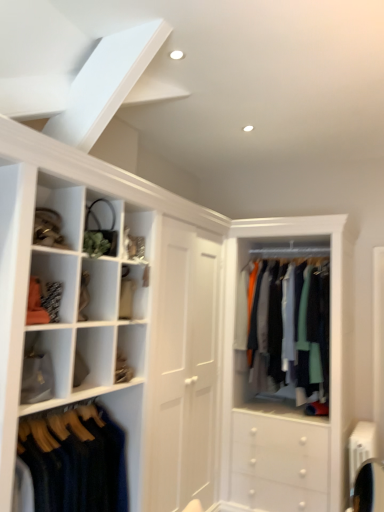
Question: From a real-world perspective, is matte gold purse at upper left, marked as the 2th cabinet in a bottom-to-top arrangement, physically located above or below matte black purse at upper left, which is the third cabinet in bottom-to-top order?

Choices:
 (A) below
 (B) above

Answer: (A)

Question: Looking at the image, does matte gold purse at upper left, marked as the 2th cabinet in a bottom-to-top arrangement, seem bigger or smaller compared to matte black purse at upper left, which is the third cabinet in bottom-to-top order?

Choices:
 (A) small
 (B) big

Answer: (B)

Question: Estimate the real-world distances between objects in this image. Which object is closer to the silky cotton shirts at center, the second clothing when ordered from left to right?

Choices:
 (A) dark blue wool sweater at lower left, placed as the first clothing when sorted from left to right
 (B) matte gold purse at upper left, marked as the 2th cabinet in a bottom-to-top arrangement
 (C) matte white shelf at lower left, placed as the first cabinet when sorted from bottom to top
 (D) matte black purse at upper left, which is the third cabinet in bottom-to-top order

Answer: (A)

Question: Estimate the real-world distances between objects in this image. Which object is farther from the matte gold purse at upper left, the second cabinet positioned from the top?

Choices:
 (A) silky cotton shirts at center, the 1th clothing from the back
 (B) matte black purse at upper left, which is the third cabinet in bottom-to-top order
 (C) matte white shelf at lower left, positioned as the third cabinet in top-to-bottom order
 (D) dark blue wool sweater at lower left, which is the 2th clothing in back-to-front order

Answer: (A)